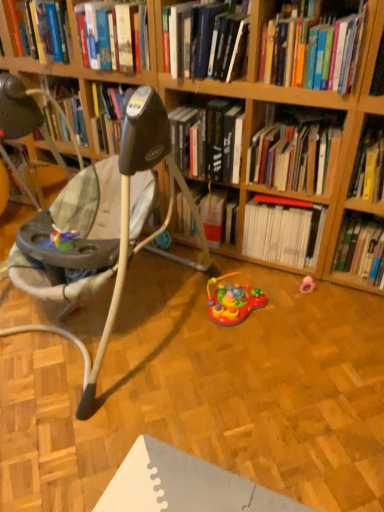
Identify the location of free point below beige fabric baby swing at left (from a real-world perspective). The height and width of the screenshot is (512, 384). (119, 319).